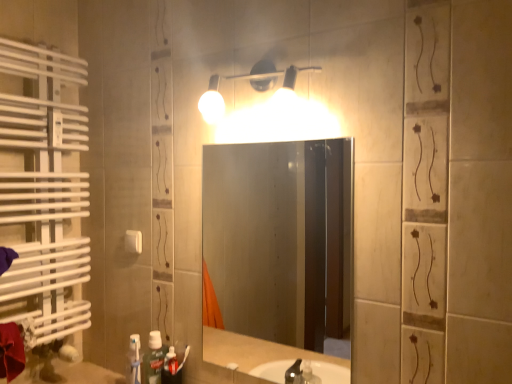
Question: Considering the positions of green matte toothpaste at lower left and matte white light fixture at upper center in the image, is green matte toothpaste at lower left wider or thinner than matte white light fixture at upper center?

Choices:
 (A) wide
 (B) thin

Answer: (B)

Question: Visually, is green matte toothpaste at lower left positioned to the left or to the right of matte white light fixture at upper center?

Choices:
 (A) right
 (B) left

Answer: (B)

Question: Estimate the real-world distances between objects in this image. Which object is closer to the white plastic light switch at upper center?

Choices:
 (A) matte white light fixture at upper center
 (B) smooth glass mirror at center
 (C) green matte toothpaste at lower left

Answer: (C)

Question: Which of these objects is positioned closest to the matte white light fixture at upper center?

Choices:
 (A) smooth glass mirror at center
 (B) white plastic light switch at upper center
 (C) green matte toothpaste at lower left

Answer: (B)